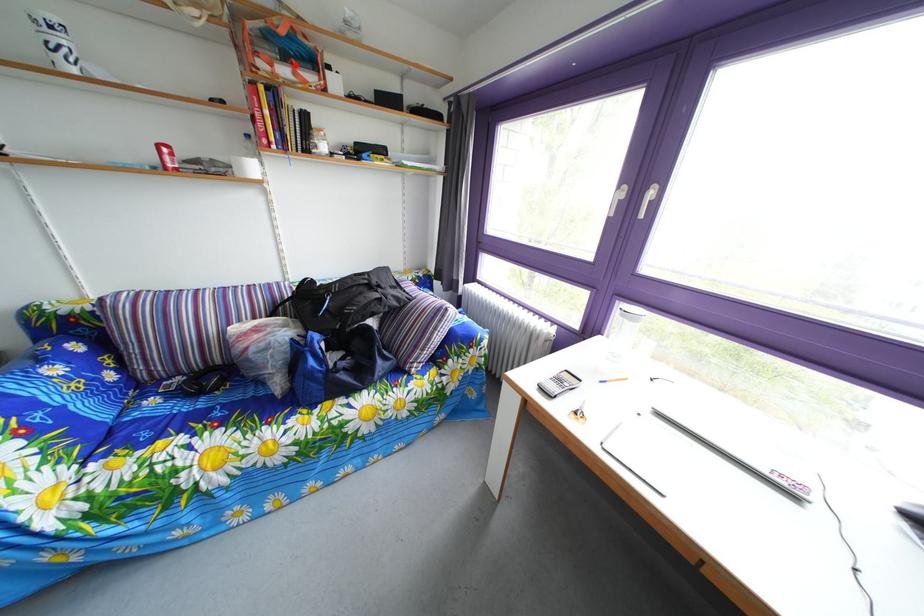
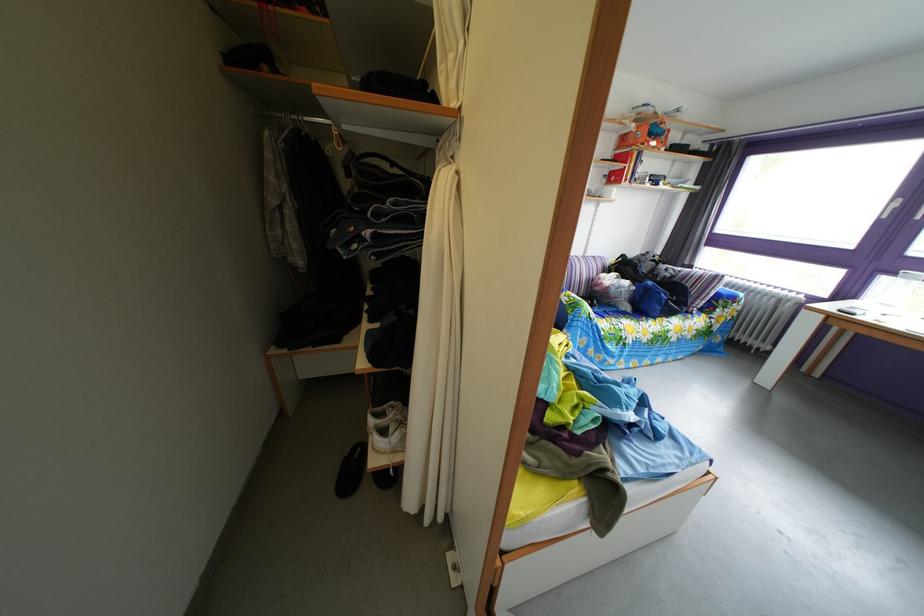
Locate, in the second image, the point that corresponds to the highlighted location in the first image.

(661, 144)